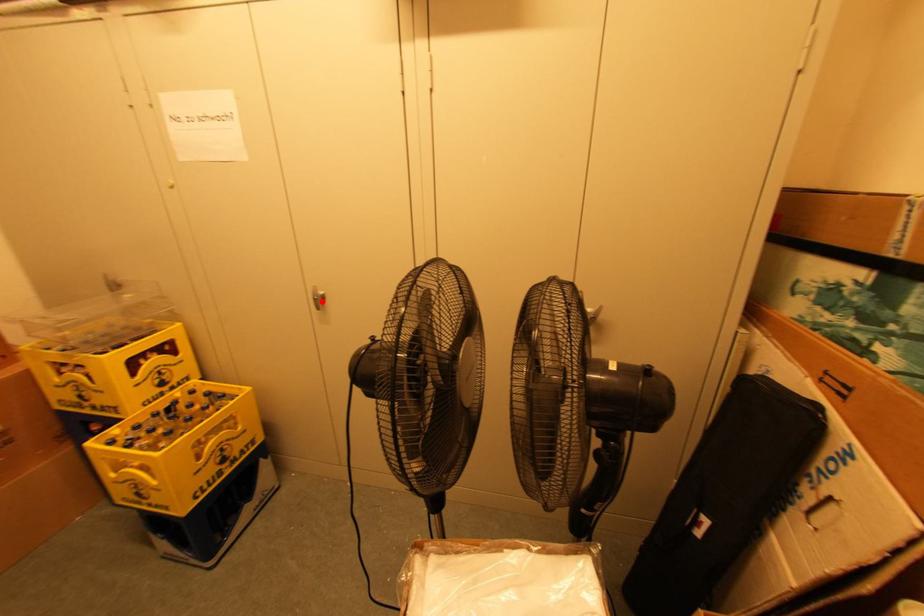
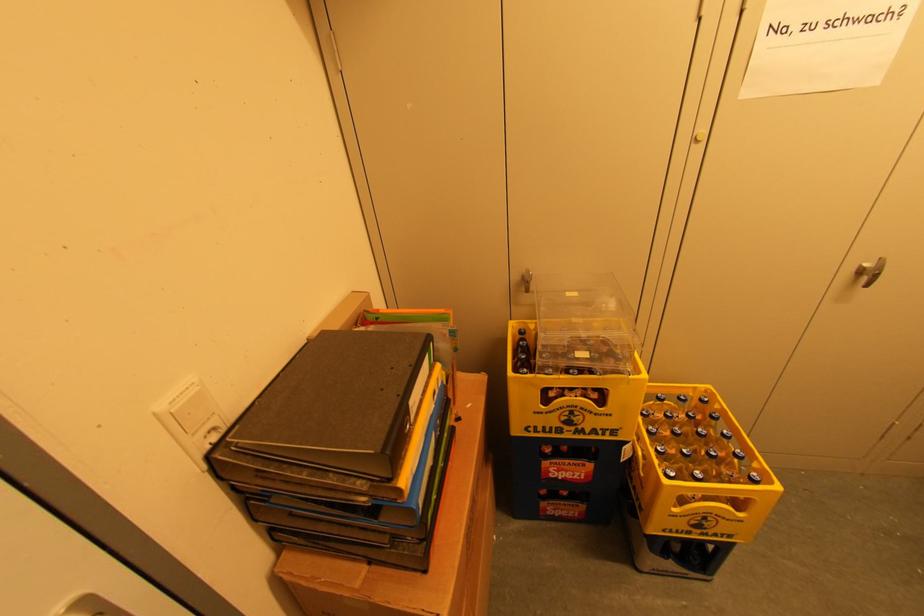
Locate, in the second image, the point that corresponds to the highlighted location in the first image.

(869, 275)